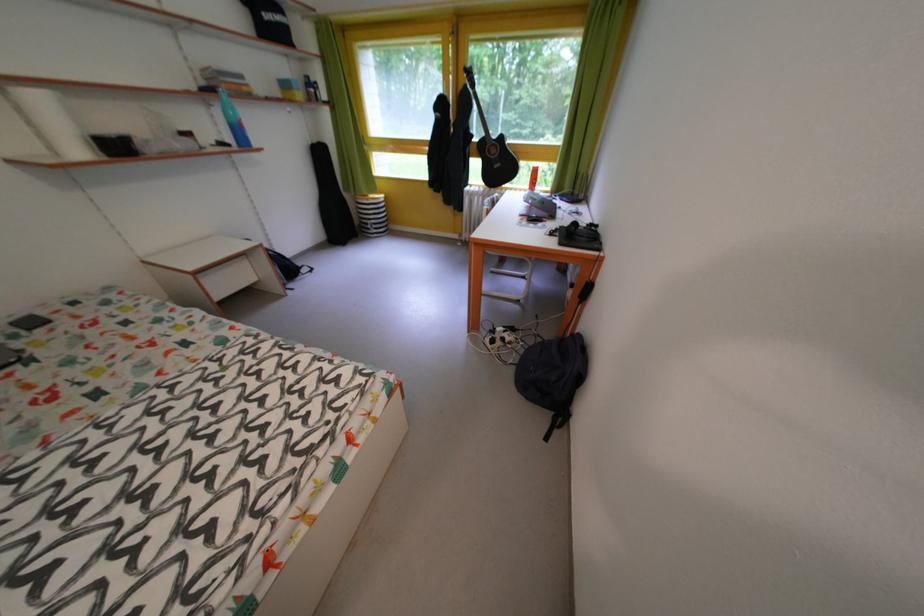
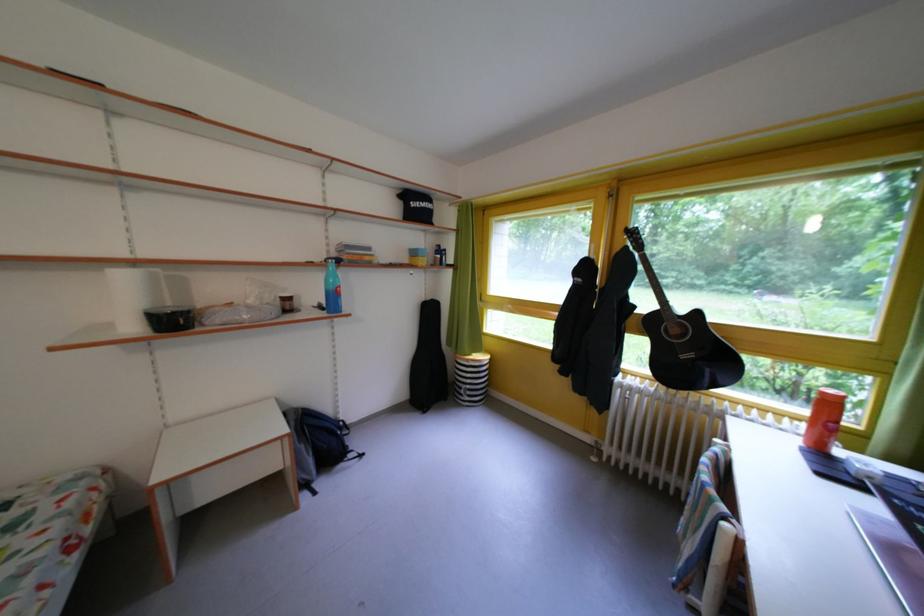
Locate, in the second image, the point that corresponds to the point at 128,155 in the first image.

(184, 328)